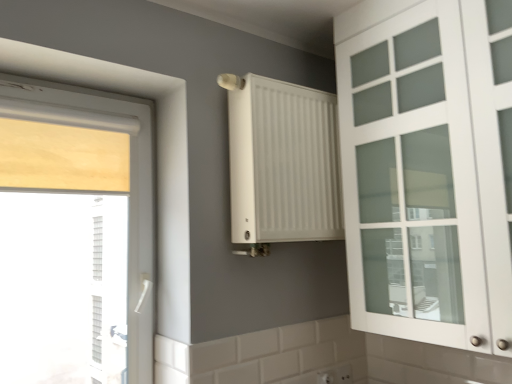
Question: From a real-world perspective, is white plastic electric outlet at lower center above or below white matte cabinet at right?

Choices:
 (A) below
 (B) above

Answer: (A)

Question: Would you say white plastic electric outlet at lower center is to the left or to the right of white matte cabinet at right in the picture?

Choices:
 (A) right
 (B) left

Answer: (B)

Question: Based on their relative distances, which object is nearer to the white matte cabinet at right?

Choices:
 (A) wooden blind at left
 (B) white matte radiator at center
 (C) white plastic electric outlet at lower center

Answer: (B)

Question: Based on their relative distances, which object is farther from the white matte cabinet at right?

Choices:
 (A) white plastic electric outlet at lower center
 (B) white matte radiator at center
 (C) wooden blind at left

Answer: (C)